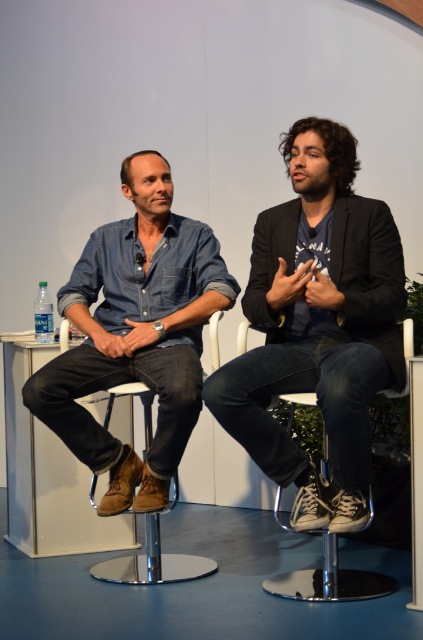
You are a photographer at the event and need to capture a clear photo of both the dark blue denim jeans at center and the denim shirt at left. Which object should you focus on first to ensure both are in focus?

The dark blue denim jeans at center is in front of the denim shirt at left, so you should focus on the dark blue denim jeans at center first to ensure both are in focus.

What are the coordinates of the dark blue denim jeans at center?

The coordinates of the dark blue denim jeans at center are at point (318, 324).